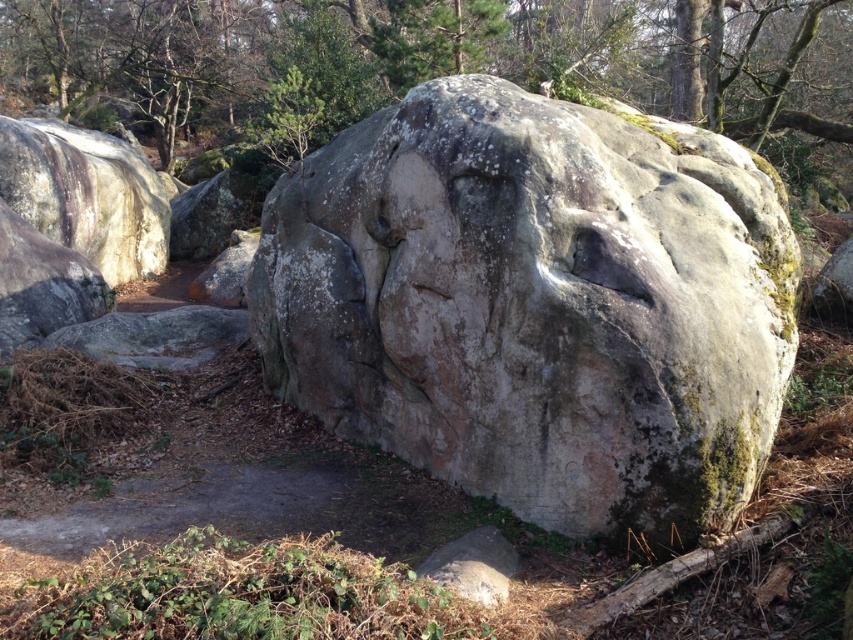
The height and width of the screenshot is (640, 853). What do you see at coordinates (537, 305) in the screenshot?
I see `gray stone face at center` at bounding box center [537, 305].

Does gray stone face at center have a greater width compared to green mossy rock at upper center?

No, gray stone face at center is not wider than green mossy rock at upper center.

Which is in front, point (302, 266) or point (70, 6)?

Point (302, 266)

Image resolution: width=853 pixels, height=640 pixels. What are the coordinates of `gray stone face at center` in the screenshot? It's located at (537, 305).